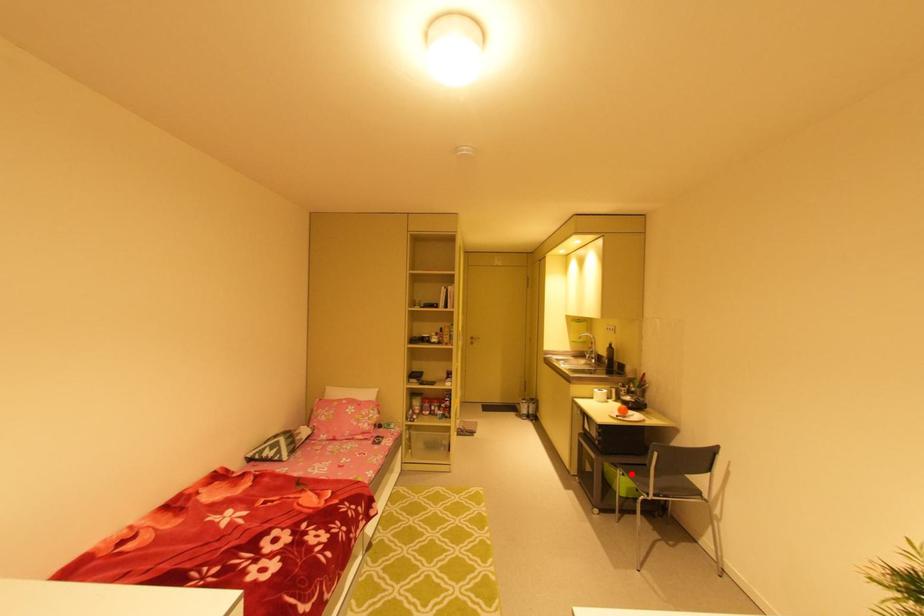
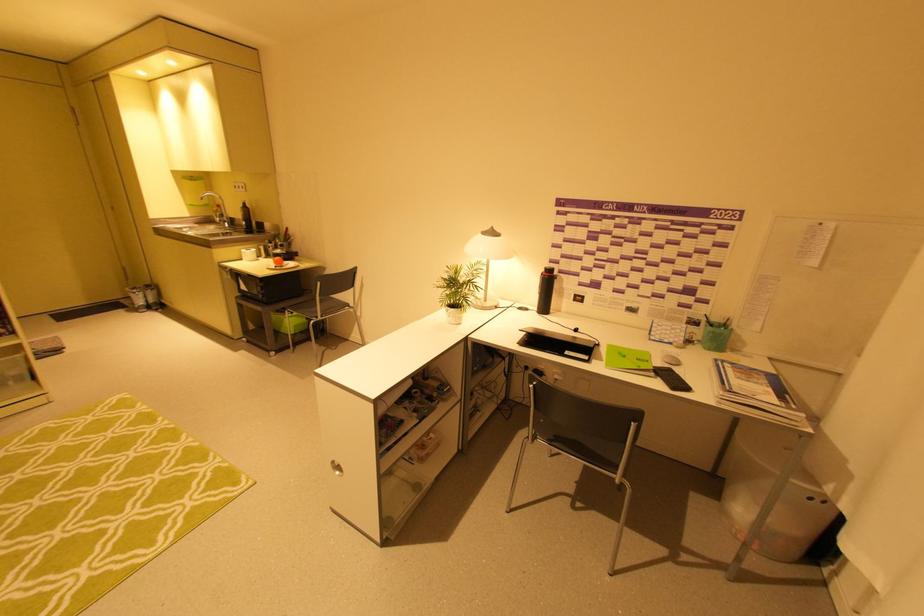
Locate, in the second image, the point that corresponds to the highlighted location in the first image.

(299, 310)